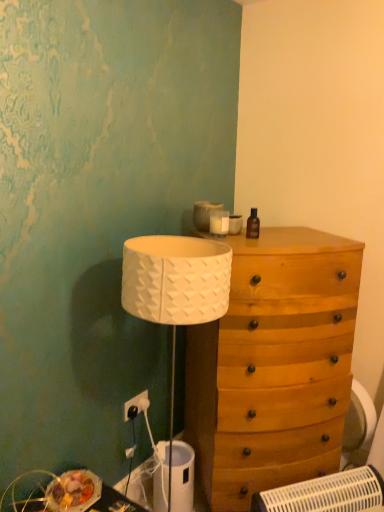
Question: Considering the relative sizes of white plastic swivel chair at lower right and wooden drawer at center in the image provided, is white plastic swivel chair at lower right wider than wooden drawer at center?

Choices:
 (A) no
 (B) yes

Answer: (A)

Question: From a real-world perspective, is white plastic swivel chair at lower right beneath wooden drawer at center?

Choices:
 (A) yes
 (B) no

Answer: (B)

Question: Are white plastic swivel chair at lower right and wooden drawer at center located far from each other?

Choices:
 (A) no
 (B) yes

Answer: (A)

Question: Does white plastic swivel chair at lower right turn towards wooden drawer at center?

Choices:
 (A) yes
 (B) no

Answer: (B)

Question: Is white plastic swivel chair at lower right further to camera compared to wooden drawer at center?

Choices:
 (A) yes
 (B) no

Answer: (A)

Question: From the image's perspective, is white plastic swivel chair at lower right located beneath wooden drawer at center?

Choices:
 (A) no
 (B) yes

Answer: (A)

Question: Is wooden drawer at center thinner than white plastic swivel chair at lower right?

Choices:
 (A) yes
 (B) no

Answer: (B)

Question: Is wooden drawer at center bigger than white plastic swivel chair at lower right?

Choices:
 (A) yes
 (B) no

Answer: (A)

Question: Is white plastic swivel chair at lower right inside wooden drawer at center?

Choices:
 (A) no
 (B) yes

Answer: (A)

Question: Is wooden drawer at center taller than white plastic swivel chair at lower right?

Choices:
 (A) no
 (B) yes

Answer: (A)

Question: Does wooden drawer at center come in front of white plastic swivel chair at lower right?

Choices:
 (A) yes
 (B) no

Answer: (A)

Question: From the image's perspective, is wooden drawer at center located above white plastic swivel chair at lower right?

Choices:
 (A) no
 (B) yes

Answer: (A)

Question: Is brown glass bottle at upper right located within white plastic electric outlet at lower left?

Choices:
 (A) yes
 (B) no

Answer: (B)